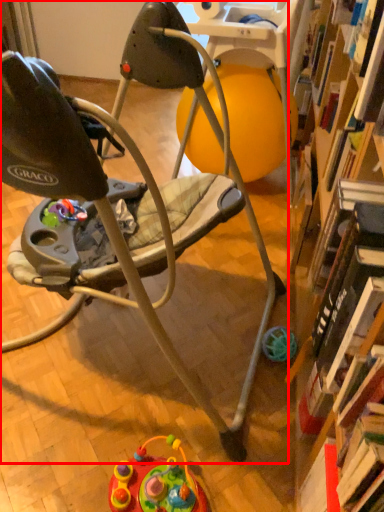
Question: From the image's perspective, what is the correct spatial relationship of chair (annotated by the red box) in relation to toy?

Choices:
 (A) above
 (B) below

Answer: (A)